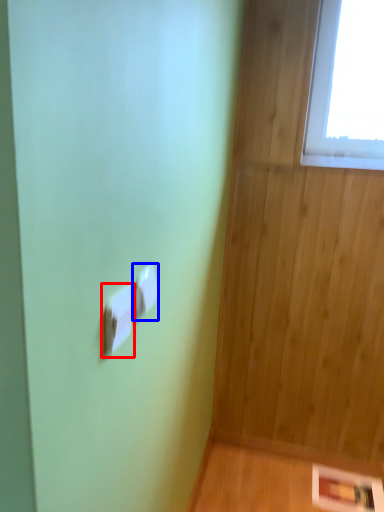
Question: Which object appears closest to the camera in this image, light switch (highlighted by a red box) or light switch (highlighted by a blue box)?

Choices:
 (A) light switch
 (B) light switch

Answer: (A)